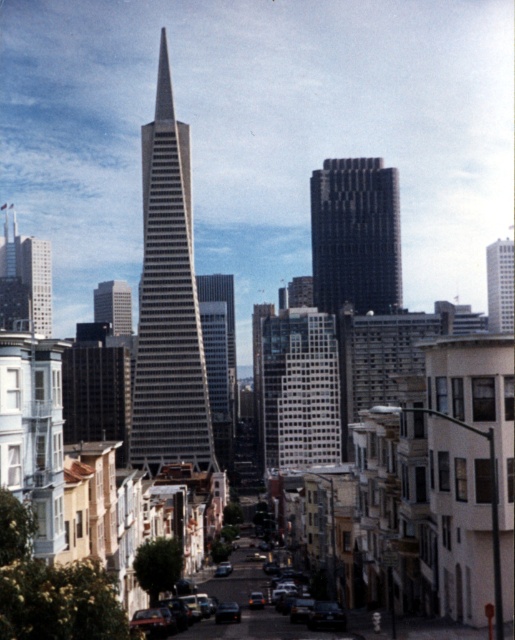
Question: Estimate the real-world distances between objects in this image. Which object is farther from the white glass building at center?

Choices:
 (A) glassy reflective skyscraper at center
 (B) white glass skyscraper at right
 (C) silver glass skyscraper at center

Answer: (B)

Question: Observing the image, what is the correct spatial positioning of glassy silver skyscraper at center in reference to shiny black sedan at center?

Choices:
 (A) left
 (B) right

Answer: (A)

Question: Does white glass skyscraper at right have a lesser width compared to glassy reflective skyscraper at center?

Choices:
 (A) yes
 (B) no

Answer: (B)

Question: Does white glass building at center lie behind shiny black sedan at center?

Choices:
 (A) yes
 (B) no

Answer: (A)

Question: Estimate the real-world distances between objects in this image. Which object is closer to the shiny black car at center?

Choices:
 (A) black glass building at center
 (B) silver glass skyscraper at center
 (C) white glass building at center
 (D) shiny black sedan at center

Answer: (D)

Question: Which point is farther to the camera?

Choices:
 (A) (234, 602)
 (B) (298, 369)
 (C) (508, 305)

Answer: (C)